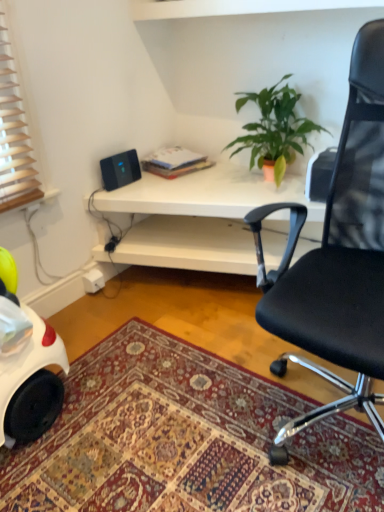
Find the location of a particular element. free spot in front of black plastic speaker at upper left is located at coordinates (106, 190).